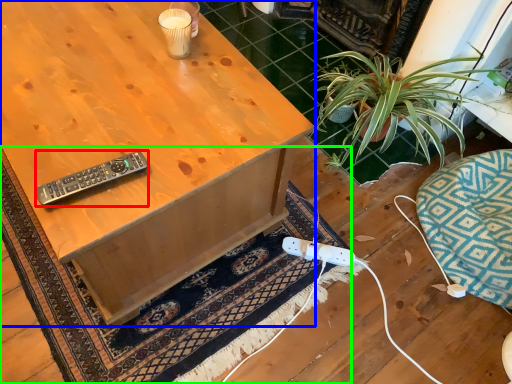
Question: Which object is positioned closest to remote control (highlighted by a red box)? Select from desk (highlighted by a blue box) and doormat (highlighted by a green box).

Choices:
 (A) desk
 (B) doormat

Answer: (A)